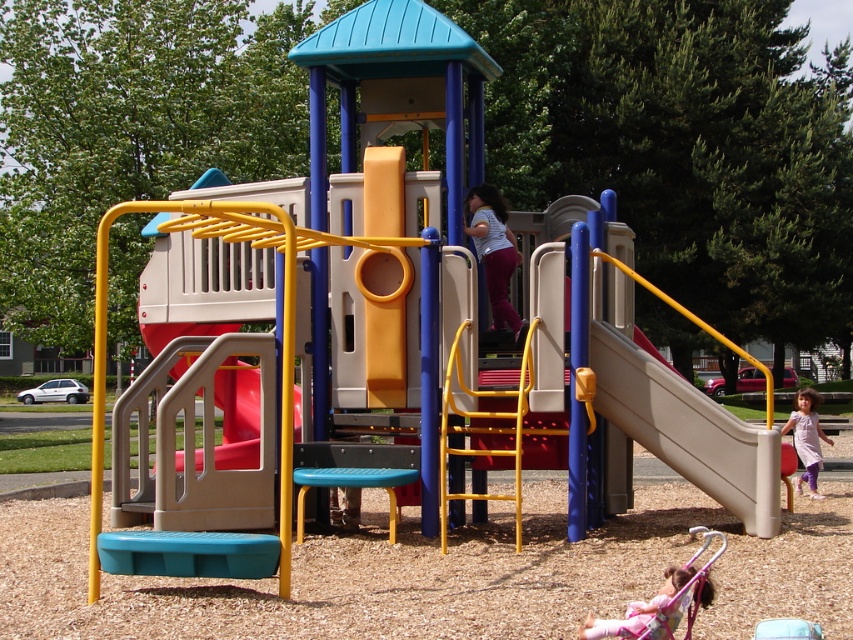
You are a parent supervising children at the playground. You notice two children wearing pastel pink fabric at lower right and light purple fabric dress at lower right. Which child is positioned lower in the image?

The pastel pink fabric at lower right is positioned below the light purple fabric dress at lower right, so the child wearing the pastel pink fabric at lower right is lower in the image.

You are standing at the entrance of the playground and want to locate two specific points marked in the image. Which of the two points, point (647,609) or point (807,442), is closer to you?

Point (647,609) is closer to the viewer than point (807,442).

You are standing at the center of the playground and looking towards the multi level structure. There is a point marked at coordinates (688, 429). Which object does this point correspond to?

The point corresponds to the beige plastic slide at right.